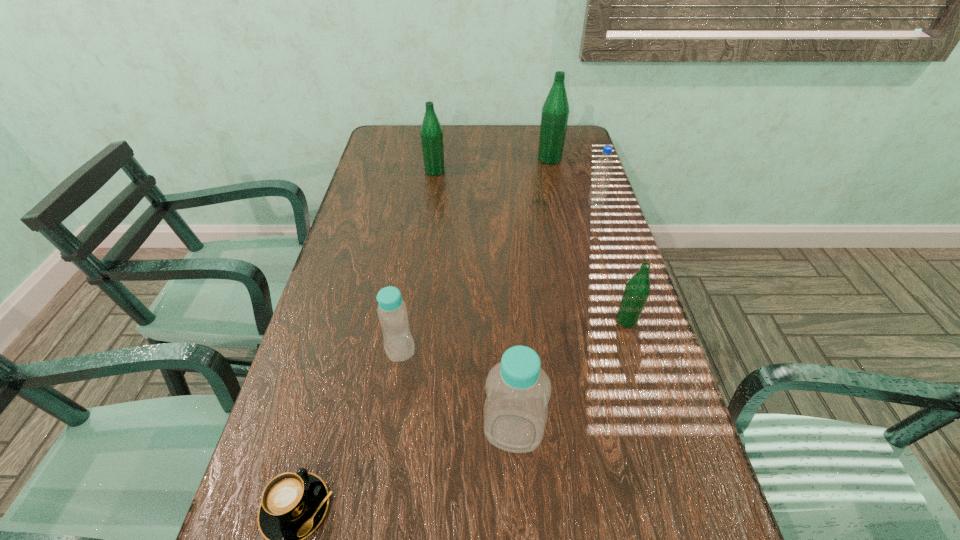
In the image, there is a desktop. Where is `vacant region at the left edge`? The image size is (960, 540). vacant region at the left edge is located at coordinates (356, 249).

Locate an element on the screen. vacant space at the right edge of the desktop is located at coordinates (574, 181).

Find the location of a particular element. The width and height of the screenshot is (960, 540). free space at the far left corner of the desktop is located at coordinates (410, 127).

Find the location of `free space between the second nearest object and the tallest bottle`. free space between the second nearest object and the tallest bottle is located at coordinates (532, 295).

Locate an element on the screen. free space between the leftmost green bottle and the water bottle is located at coordinates (516, 188).

Where is `empty space between the nearest green bottle and the water bottle`? The image size is (960, 540). empty space between the nearest green bottle and the water bottle is located at coordinates (612, 262).

Identify the location of unoccupied position between the second green bottle from right to left and the second biggest green bottle. (492, 165).

At what (x,y) coordinates should I click in order to perform the action: click on free space between the leftmost green bottle and the second bottle from right to left. Please return your answer as a coordinate pair (x, y). Looking at the image, I should click on [492, 165].

Find the location of `free space that is in between the water bottle and the fourth farthest object`. free space that is in between the water bottle and the fourth farthest object is located at coordinates (612, 262).

Choose which object is the second nearest neighbor to the fifth object from left to right. Please provide its 2D coordinates. Your answer should be formatted as a tuple, i.e. [(x, y)], where the tuple contains the x and y coordinates of a point satisfying the conditions above.

[(431, 132)]